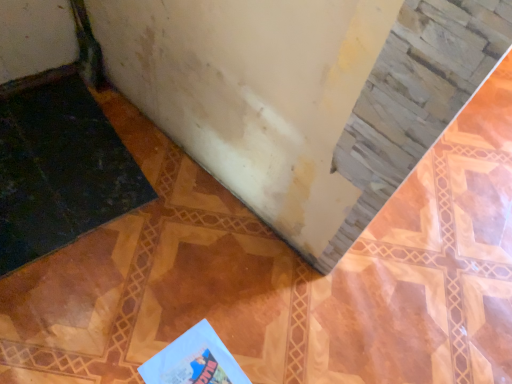
Measure the distance between black rubber doormat at lower left and camera.

black rubber doormat at lower left and camera are 3.85 feet apart.

Describe the element at coordinates (60, 171) in the screenshot. I see `black rubber doormat at lower left` at that location.

The height and width of the screenshot is (384, 512). Identify the location of black rubber doormat at lower left. (60, 171).

What do you see at coordinates (194, 360) in the screenshot?
I see `light blue paper at lower center` at bounding box center [194, 360].

In order to click on light blue paper at lower center in this screenshot , I will do `click(194, 360)`.

Where is `black rubber doormat at lower left`? The image size is (512, 384). black rubber doormat at lower left is located at coordinates point(60,171).

Based on the photo, is black rubber doormat at lower left to the left or to the right of light blue paper at lower center in the image?

black rubber doormat at lower left is to the left of light blue paper at lower center.

Is the position of black rubber doormat at lower left more distant than that of light blue paper at lower center?

Yes, the depth of black rubber doormat at lower left is greater than that of light blue paper at lower center.

Which point is more forward, [83,170] or [169,369]?

Point [169,369]

From the image's perspective, is black rubber doormat at lower left on top of light blue paper at lower center?

Correct, black rubber doormat at lower left appears higher than light blue paper at lower center in the image.

From a real-world perspective, is black rubber doormat at lower left positioned above or below light blue paper at lower center?

Clearly, from a real-world perspective, black rubber doormat at lower left is below light blue paper at lower center.

Considering the relative sizes of black rubber doormat at lower left and light blue paper at lower center in the image provided, is black rubber doormat at lower left wider than light blue paper at lower center?

Yes.

Between black rubber doormat at lower left and light blue paper at lower center, which one has less height?

Standing shorter between the two is light blue paper at lower center.

Based on their sizes in the image, would you say black rubber doormat at lower left is bigger or smaller than light blue paper at lower center?

In the image, black rubber doormat at lower left appears to be larger than light blue paper at lower center.

From the picture: Would you say light blue paper at lower center is part of black rubber doormat at lower left's contents?

No, light blue paper at lower center is located outside of black rubber doormat at lower left.

Are black rubber doormat at lower left and light blue paper at lower center beside each other?

black rubber doormat at lower left is not next to light blue paper at lower center, and they're not touching.

Is black rubber doormat at lower left turned away from light blue paper at lower center?

black rubber doormat at lower left does not have its back to light blue paper at lower center.

How many degrees apart are the facing directions of black rubber doormat at lower left and light blue paper at lower center?

The facing directions of black rubber doormat at lower left and light blue paper at lower center are 93.1 degrees apart.

You are a GUI agent. You are given a task and a screenshot of the screen. Output one action in this format:
    pyautogui.click(x=<x>, y=<y>)
    Task: Click on the doormat located behind the light blue paper at lower center
    This screenshot has height=384, width=512.
    Given the screenshot: What is the action you would take?
    pyautogui.click(x=60, y=171)

Considering the relative positions of light blue paper at lower center and black rubber doormat at lower left in the image provided, is light blue paper at lower center to the left or to the right of black rubber doormat at lower left?

From the image, it's evident that light blue paper at lower center is to the right of black rubber doormat at lower left.

Is the depth of light blue paper at lower center less than that of black rubber doormat at lower left?

Yes.

In the scene shown: Which is less distant, (213,337) or (14,163)?

Point (213,337) is closer to the camera than point (14,163).

From the image's perspective, does light blue paper at lower center appear higher than black rubber doormat at lower left?

No, from the image's perspective, light blue paper at lower center is not above black rubber doormat at lower left.

From a real-world perspective, is light blue paper at lower center beneath black rubber doormat at lower left?

Actually, light blue paper at lower center is physically above black rubber doormat at lower left in the real world.

Is light blue paper at lower center wider than black rubber doormat at lower left?

Answer: Incorrect, the width of light blue paper at lower center does not surpass that of black rubber doormat at lower left.

Between light blue paper at lower center and black rubber doormat at lower left, which one has less height?

light blue paper at lower center is shorter.

Who is smaller, light blue paper at lower center or black rubber doormat at lower left?

light blue paper at lower center is smaller.

Is black rubber doormat at lower left inside light blue paper at lower center?

Actually, black rubber doormat at lower left is outside light blue paper at lower center.

Is light blue paper at lower center not near black rubber doormat at lower left?

light blue paper at lower center is near black rubber doormat at lower left, not far away.

Is light blue paper at lower center oriented away from black rubber doormat at lower left?

No, light blue paper at lower center's orientation is not away from black rubber doormat at lower left.

How much distance is there between light blue paper at lower center and black rubber doormat at lower left?

light blue paper at lower center and black rubber doormat at lower left are 24.65 inches apart.

The image size is (512, 384). I want to click on doormat to the left of light blue paper at lower center, so click(60, 171).

The height and width of the screenshot is (384, 512). I want to click on doormat behind the light blue paper at lower center, so click(x=60, y=171).

The height and width of the screenshot is (384, 512). I want to click on doormat located above the light blue paper at lower center (from the image's perspective), so pos(60,171).